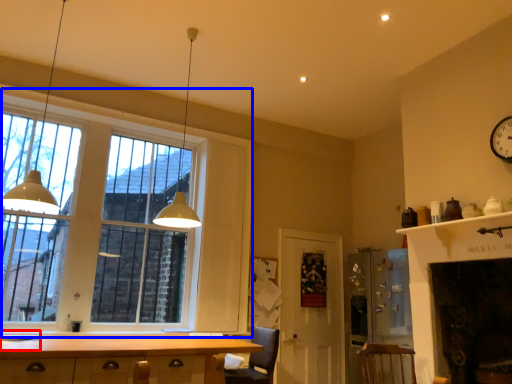
Question: Among these objects, which one is farthest to the camera, sink (highlighted by a red box) or window (highlighted by a blue box)?

Choices:
 (A) sink
 (B) window

Answer: (B)